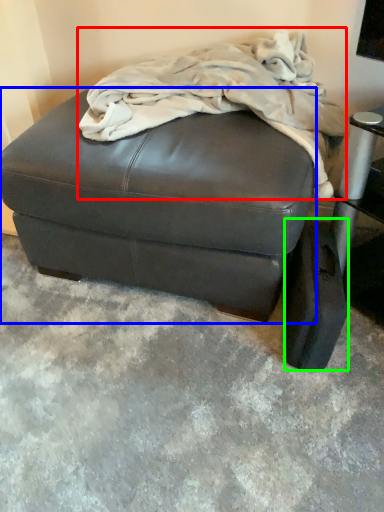
Question: Considering the real-world distances, which object is farthest from blanket (highlighted by a red box)? furniture (highlighted by a blue box) or pad (highlighted by a green box)?

Choices:
 (A) furniture
 (B) pad

Answer: (B)